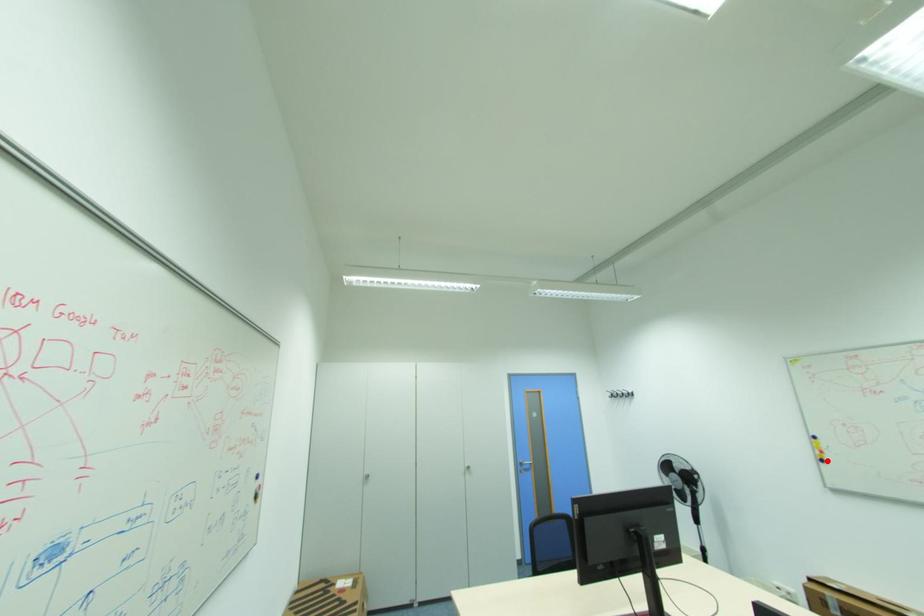
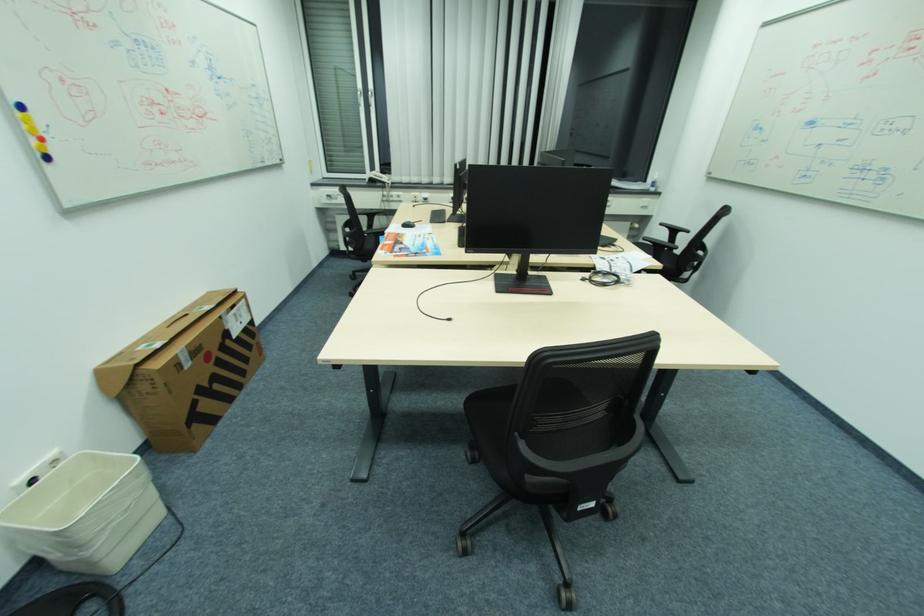
Find the pixel in the second image that matches the highlighted location in the first image.

(52, 158)